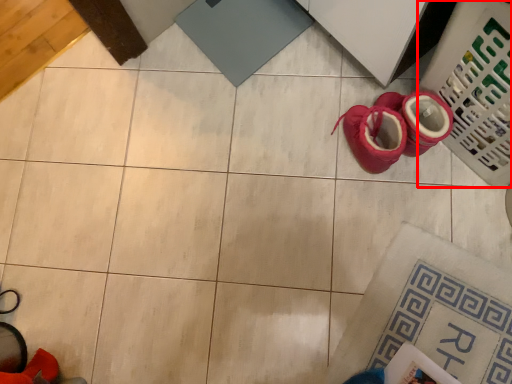
Question: From the image's perspective, what is the correct spatial positioning of laundry basket (annotated by the red box) in reference to footwear?

Choices:
 (A) above
 (B) below

Answer: (A)